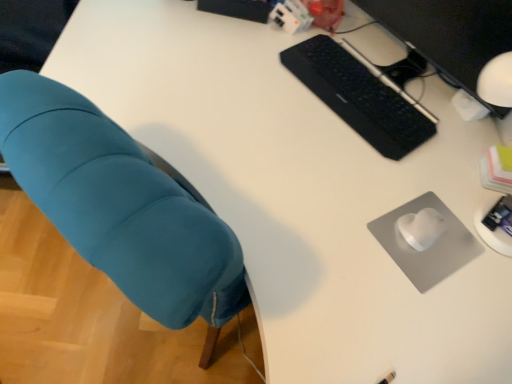
Where is `free point to the right of gray matte mousepad at lower right`? free point to the right of gray matte mousepad at lower right is located at coordinates (489, 283).